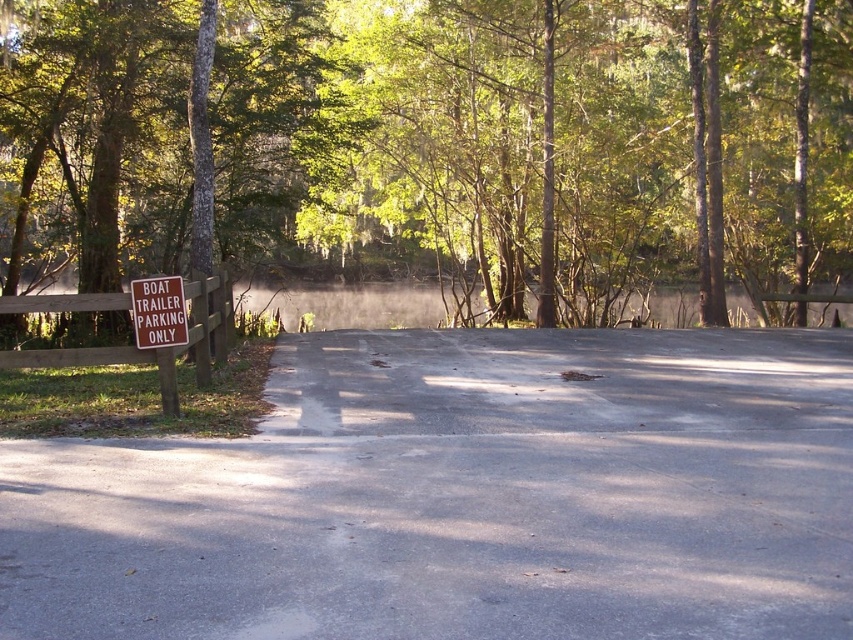
Who is taller, green leafy tree at upper center or misty water at center?

Standing taller between the two is green leafy tree at upper center.

Which of these two, green leafy tree at upper center or misty water at center, stands shorter?

With less height is misty water at center.

Is point (747, 104) behind point (408, 301)?

That is False.

This screenshot has height=640, width=853. I want to click on green leafy tree at upper center, so click(541, 140).

Does point (390, 310) come farther from viewer compared to point (149, 339)?

Yes, point (390, 310) is farther from viewer.

Between misty water at center and brown wooden sign at left, which one has more height?

misty water at center

At what (x,y) coordinates should I click in order to perform the action: click on misty water at center. Please return your answer as a coordinate pair (x, y). Looking at the image, I should click on (347, 305).

Does gray asphalt road at center have a lesser width compared to misty water at center?

Yes, gray asphalt road at center is thinner than misty water at center.

Does gray asphalt road at center have a lesser height compared to misty water at center?

Correct, gray asphalt road at center is not as tall as misty water at center.

Between point (338, 502) and point (631, 308), which one is positioned in front?

Point (338, 502) is in front.

This screenshot has width=853, height=640. I want to click on gray asphalt road at center, so point(462,497).